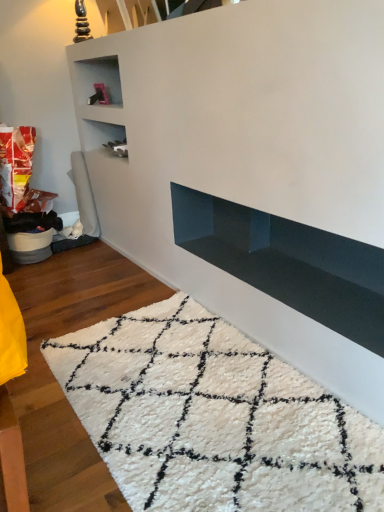
Question: Would you say glossy dark blue shelf at lower center is inside or outside white shaggy rug at lower center?

Choices:
 (A) inside
 (B) outside

Answer: (B)

Question: Looking at their shapes, would you say glossy dark blue shelf at lower center is wider or thinner than white shaggy rug at lower center?

Choices:
 (A) thin
 (B) wide

Answer: (A)

Question: In terms of size, does glossy dark blue shelf at lower center appear bigger or smaller than white shaggy rug at lower center?

Choices:
 (A) small
 (B) big

Answer: (A)

Question: Looking at their shapes, would you say white shaggy rug at lower center is wider or thinner than glossy dark blue shelf at lower center?

Choices:
 (A) thin
 (B) wide

Answer: (B)

Question: In terms of height, does white shaggy rug at lower center look taller or shorter compared to glossy dark blue shelf at lower center?

Choices:
 (A) short
 (B) tall

Answer: (A)

Question: From the image's perspective, is white shaggy rug at lower center above or below glossy dark blue shelf at lower center?

Choices:
 (A) above
 (B) below

Answer: (B)

Question: Relative to glossy dark blue shelf at lower center, is white shaggy rug at lower center in front or behind?

Choices:
 (A) front
 (B) behind

Answer: (A)